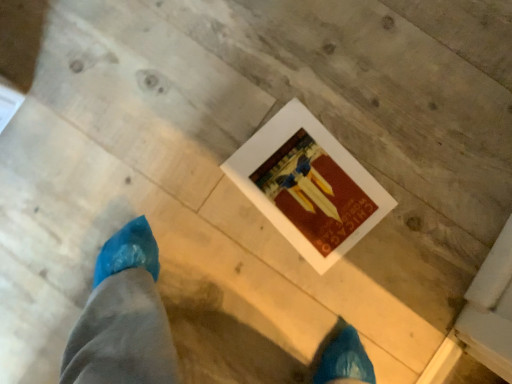
Find the location of a particular element. blank space situated above matte paper postcard at center (from a real-world perspective) is located at coordinates (306, 187).